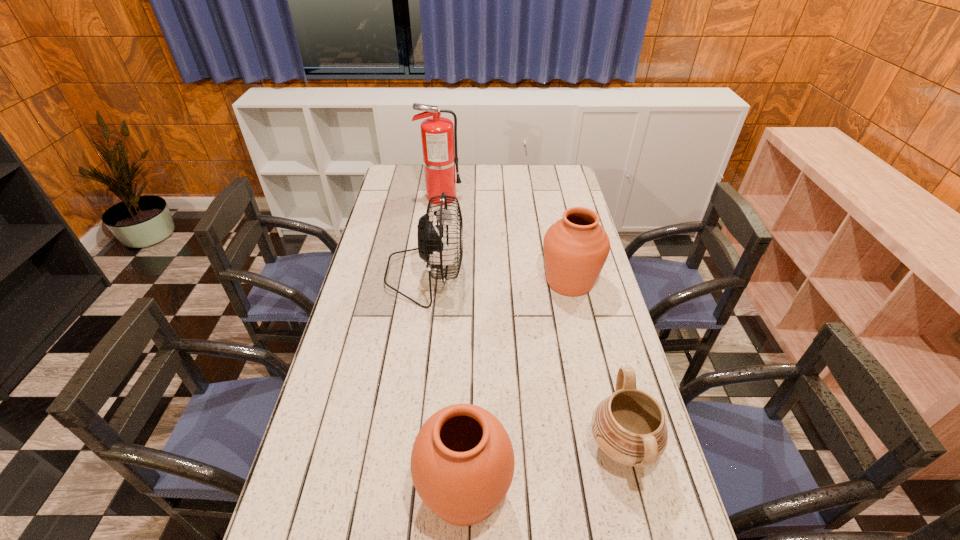
This screenshot has width=960, height=540. I want to click on empty space that is in between the farthest urn and the shortest object, so click(596, 363).

The image size is (960, 540). Find the location of `vacant space that is in between the farthest urn and the fire extinguisher`. vacant space that is in between the farthest urn and the fire extinguisher is located at coordinates (505, 239).

The width and height of the screenshot is (960, 540). I want to click on vacant area that lies between the fan and the farthest urn, so click(x=497, y=278).

Image resolution: width=960 pixels, height=540 pixels. I want to click on free space between the shortest urn and the fan, so [523, 360].

Identify the location of empty space between the farthest urn and the shortest urn. This screenshot has height=540, width=960. (596, 363).

Identify the location of the second closest object to the tallest object. (576, 247).

Where is `object that is the fourth closest to the shortest urn`? The image size is (960, 540). object that is the fourth closest to the shortest urn is located at coordinates (438, 134).

Identify which urn is the closest to the leftmost urn. Please provide its 2D coordinates. Your answer should be formatted as a tuple, i.e. [(x, y)], where the tuple contains the x and y coordinates of a point satisfying the conditions above.

[(629, 426)]

Locate which urn is the closest to the shortest urn. Please provide its 2D coordinates. Your answer should be formatted as a tuple, i.e. [(x, y)], where the tuple contains the x and y coordinates of a point satisfying the conditions above.

[(462, 463)]

You are a GUI agent. You are given a task and a screenshot of the screen. Output one action in this format:
    pyautogui.click(x=<x>, y=<y>)
    Task: Click on the vacant space that satisfies the following two spatial constraints: 1. at the nozzle of the farthest urn; 2. on the left side of the tallest object
    This screenshot has height=540, width=960.
    Given the screenshot: What is the action you would take?
    pyautogui.click(x=431, y=281)